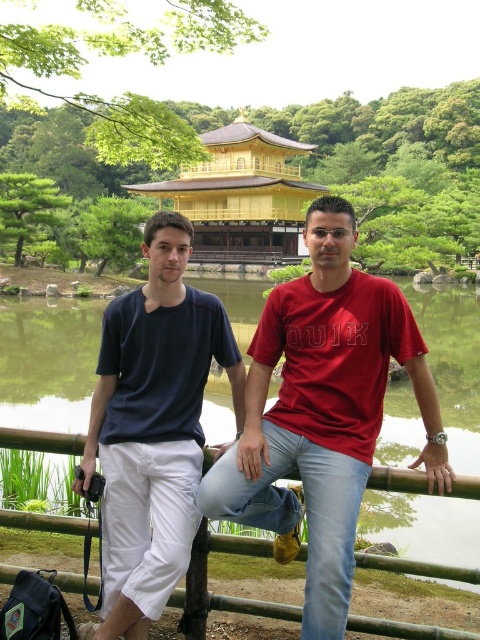
You are standing at the point with coordinates point (206, 168) and want to walk towards the temple in the background. Which direction should you go relative to the point (360, 374)?

Since point (360, 374) is closer to the viewer than point (206, 168), you should walk away from point (360, 374) towards the temple in the background.